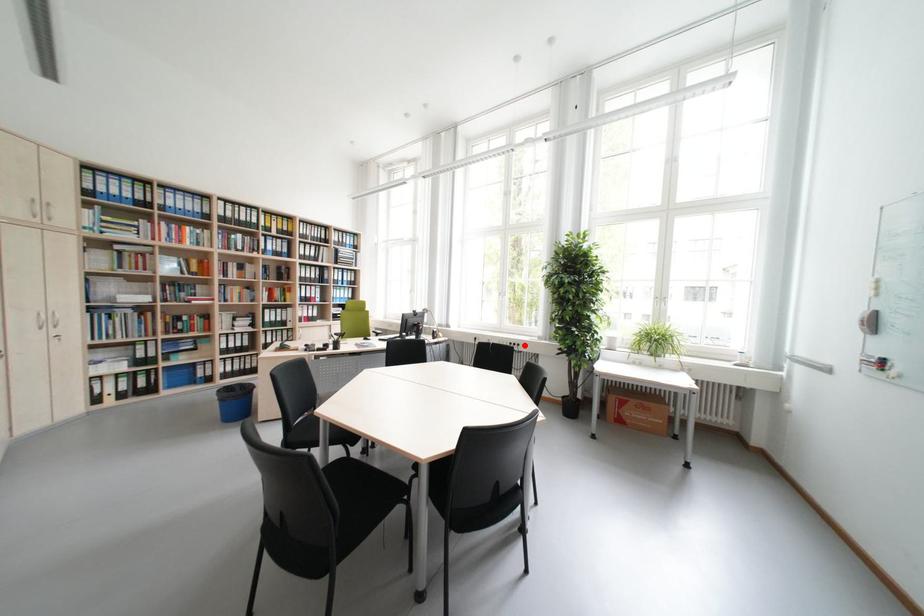
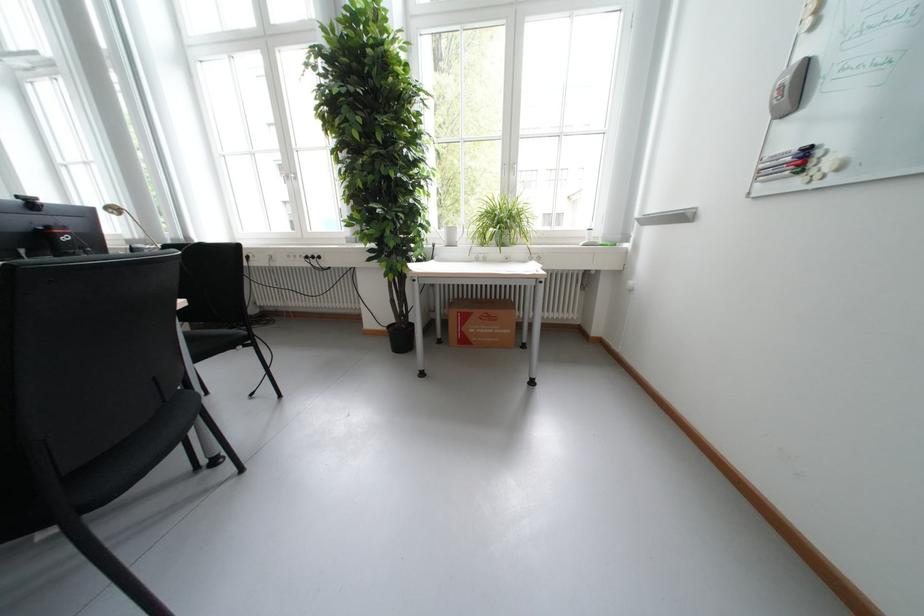
Locate, in the second image, the point that corresponds to the highlighted location in the first image.

(322, 257)